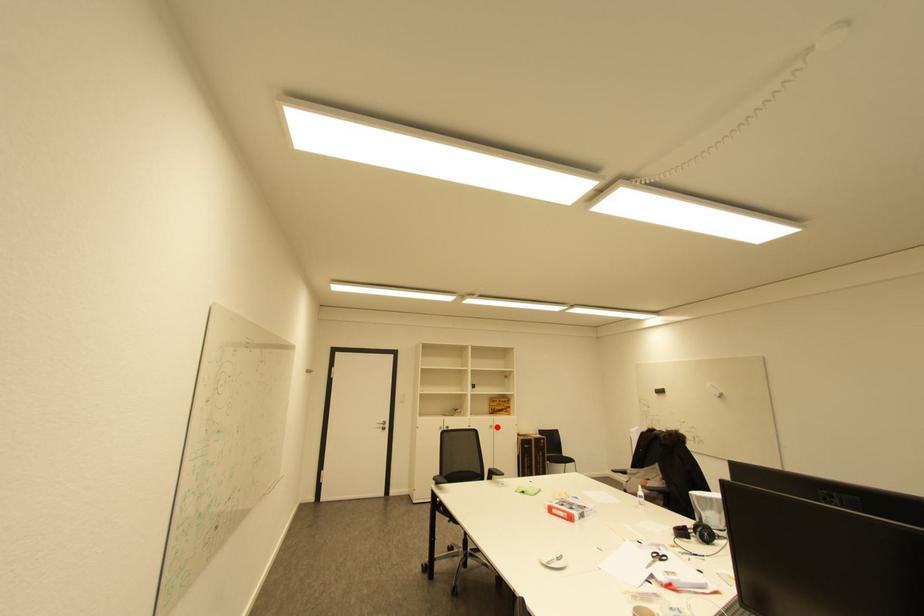
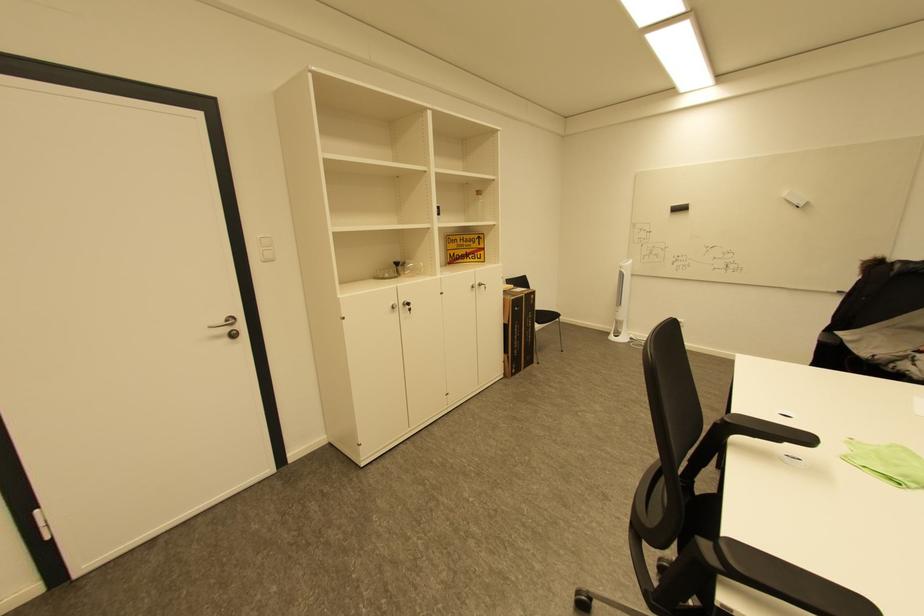
Find the pixel in the second image that matches the highlighted location in the first image.

(479, 286)